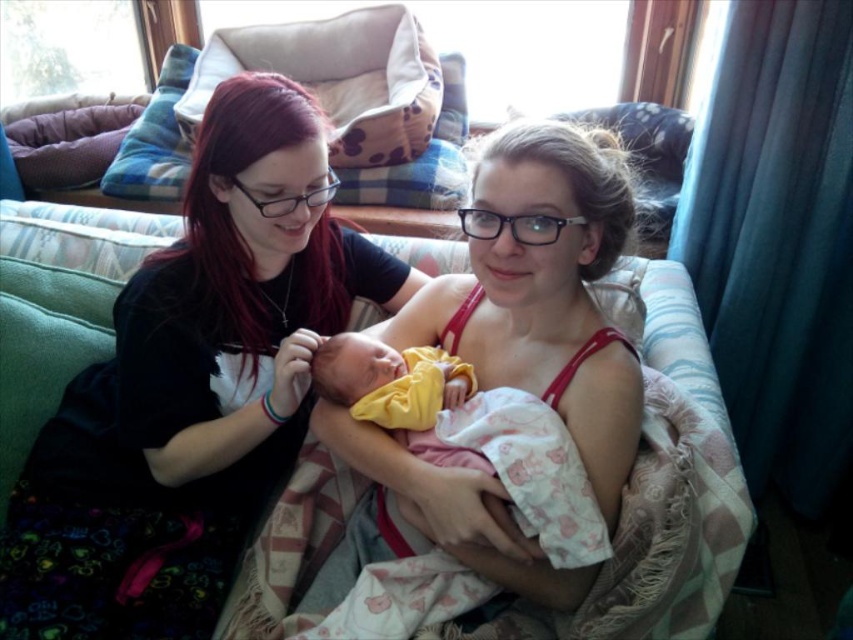
Question: Which point is closer to the camera?

Choices:
 (A) pink fabric baby at center
 (B) yellow fabric newborn at center
 (C) black matte shirt at upper left

Answer: (B)

Question: Is black matte shirt at upper left behind pink fabric baby at center?

Choices:
 (A) no
 (B) yes

Answer: (B)

Question: Can you confirm if black matte shirt at upper left is thinner than pink fabric baby at center?

Choices:
 (A) no
 (B) yes

Answer: (A)

Question: Which object appears farthest from the camera in this image?

Choices:
 (A) black matte shirt at upper left
 (B) yellow fabric newborn at center
 (C) pink fabric baby at center

Answer: (A)

Question: Is black matte shirt at upper left to the left of pink fabric baby at center from the viewer's perspective?

Choices:
 (A) no
 (B) yes

Answer: (B)

Question: Based on their relative distances, which object is farther from the yellow fabric newborn at center?

Choices:
 (A) pink fabric baby at center
 (B) black matte shirt at upper left

Answer: (B)